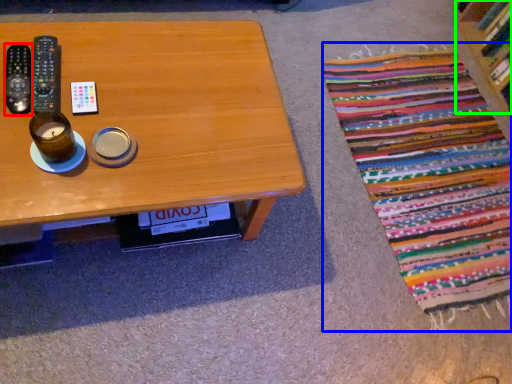
Question: Which object is positioned farthest from remote control (highlighted by a red box)? Select from blanket (highlighted by a blue box) and shelf (highlighted by a green box).

Choices:
 (A) blanket
 (B) shelf

Answer: (B)